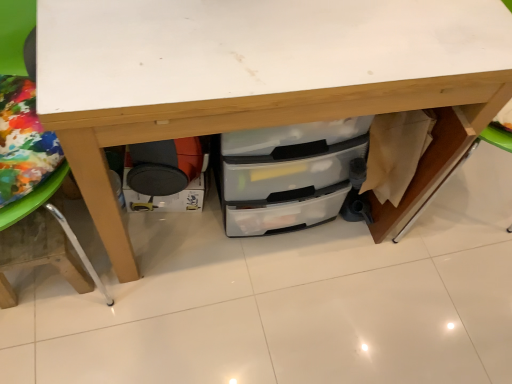
This screenshot has width=512, height=384. I want to click on matte black drawer at lower left, so click(x=166, y=198).

In order to face transparent plastic drawers at center, should I rotate leftwards or rightwards?

It's best to rotate right around 1.458 degrees.

This screenshot has width=512, height=384. Find the location of `matte black drawer at lower left`. matte black drawer at lower left is located at coordinates (166, 198).

Consider the image. Which is farther, (430, 163) or (72, 269)?

The point (72, 269) is more distant.

Can you confirm if transparent plastic drawers at center is wider than wooden table leg at lower left?

Incorrect, the width of transparent plastic drawers at center does not surpass that of wooden table leg at lower left.

From the image's perspective, would you say transparent plastic drawers at center is positioned over wooden table leg at lower left?

Yes.

How distant is wooden table leg at lower left from matte black drawer at lower left?

wooden table leg at lower left is 12.90 inches from matte black drawer at lower left.

Is wooden table leg at lower left turned away from matte black drawer at lower left?

That's not correct — wooden table leg at lower left is not looking away from matte black drawer at lower left.

Does wooden table leg at lower left lie behind matte black drawer at lower left?

No, wooden table leg at lower left is closer to the viewer.

Considering the sizes of wooden table leg at lower left and matte black drawer at lower left in the image, is wooden table leg at lower left wider or thinner than matte black drawer at lower left?

wooden table leg at lower left is wider than matte black drawer at lower left.

Is matte black drawer at lower left oriented away from transparent plastic drawers at center?

That's right, matte black drawer at lower left is facing away from transparent plastic drawers at center.

Is transparent plastic drawers at center located within matte black drawer at lower left?

That's incorrect, transparent plastic drawers at center is not inside matte black drawer at lower left.

Does point (134, 207) lie in front of point (249, 1)?

That is False.

Which object is positioned more to the right, matte black drawer at lower left or wooden table leg at lower left?

matte black drawer at lower left is more to the right.

Is matte black drawer at lower left completely or partially outside of wooden table leg at lower left?

Yes, matte black drawer at lower left is outside of wooden table leg at lower left.

Does point (126, 178) lie behind point (9, 196)?

Yes, point (126, 178) is farther from viewer.

From a real-world perspective, is transparent plastic drawers at center positioned over matte black drawer at lower left based on gravity?

Yes, from a real-world perspective, transparent plastic drawers at center is above matte black drawer at lower left.

In terms of height, does transparent plastic drawers at center look taller or shorter compared to matte black drawer at lower left?

Considering their sizes, transparent plastic drawers at center has more height than matte black drawer at lower left.

Which point is more distant from viewer, (381, 68) or (200, 185)?

The point (200, 185) is more distant.

Between wooden table leg at lower left and transparent plastic drawers at center, which one has less height?

transparent plastic drawers at center is shorter.

How different are the orientations of wooden table leg at lower left and transparent plastic drawers at center in degrees?

There is a 0.935-degree angle between the facing directions of wooden table leg at lower left and transparent plastic drawers at center.

Looking at this image, does wooden table leg at lower left turn towards transparent plastic drawers at center?

No, wooden table leg at lower left does not turn towards transparent plastic drawers at center.

Between wooden table leg at lower left and transparent plastic drawers at center, which one has smaller width?

With smaller width is transparent plastic drawers at center.

Where is `furniture located above the transparent plastic drawers at center (from a real-world perspective)`? furniture located above the transparent plastic drawers at center (from a real-world perspective) is located at coordinates (33, 193).

Locate an element on the screen. drawer on the right of wooden table leg at lower left is located at coordinates (166, 198).

Which object lies nearer to the anchor point matte black drawer at lower left, wooden table leg at lower left or transparent plastic drawers at center?

The object closer to matte black drawer at lower left is wooden table leg at lower left.

From the image, which object appears to be nearer to wooden table leg at lower left, transparent plastic drawers at center or matte black drawer at lower left?

matte black drawer at lower left is positioned closer to the anchor wooden table leg at lower left.

From the picture: Looking at the image, which one is located closer to matte black drawer at lower left, transparent plastic drawers at center or wooden table leg at lower left?

The object closer to matte black drawer at lower left is wooden table leg at lower left.

Based on their spatial positions, is matte black drawer at lower left or wooden table leg at lower left further from transparent plastic drawers at center?

matte black drawer at lower left is positioned further to the anchor transparent plastic drawers at center.

Which object lies nearer to the anchor point transparent plastic drawers at center, wooden table leg at lower left or matte black drawer at lower left?

wooden table leg at lower left is positioned closer to the anchor transparent plastic drawers at center.

Based on their spatial positions, is matte black drawer at lower left or transparent plastic drawers at center further from wooden table leg at lower left?

The object further to wooden table leg at lower left is transparent plastic drawers at center.

Identify the location of desk between wooden table leg at lower left and matte black drawer at lower left from front to back. The image size is (512, 384). (258, 76).